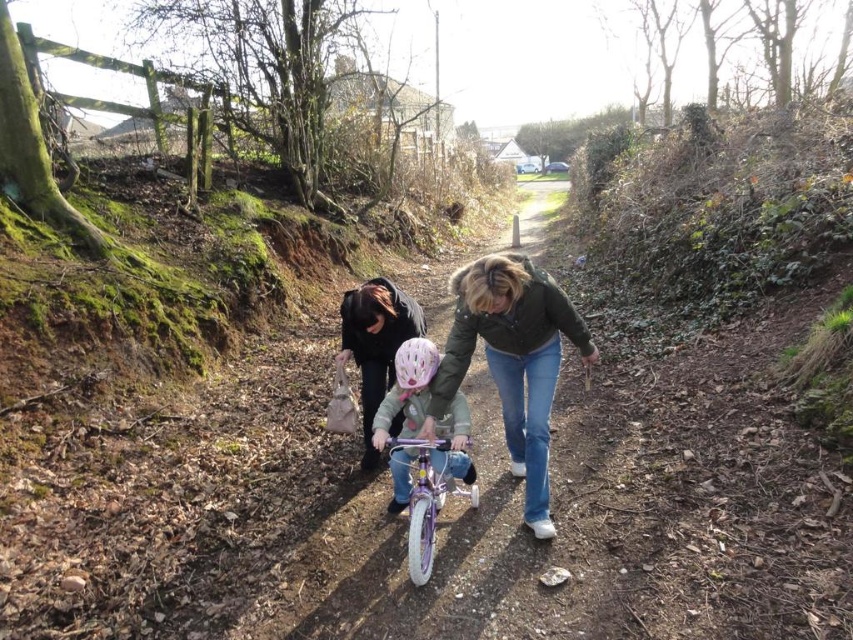
You are standing on the path and want to walk towards the point labeled as point [415,515]. Which direction should you move relative to point [506,387]?

You should move away from point [506,387] because point [415,515] is further away from the camera than point [506,387].

You are a pedestrian walking along the path and see the pink matte helmet at center and the purple metallic bicycle at center. Which object is closer to you?

The pink matte helmet at center is closer to you because the purple metallic bicycle at center is behind it.

In the scene shown: You are a photographer standing on the path and want to capture both the pink matte helmet at center and the matte black jacket at center in your photo. Which object will appear larger in the photo?

The pink matte helmet at center will appear larger in the photo because it is closer to the viewer than the matte black jacket at center.